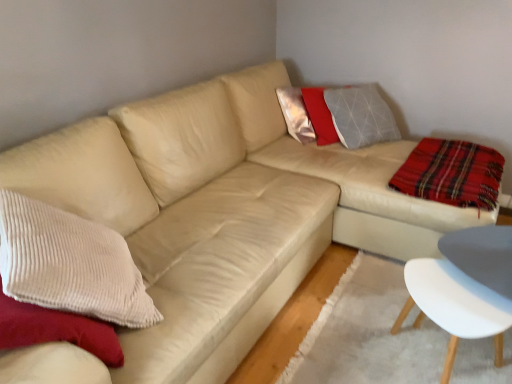
I want to click on free region on the left part of white plastic chair at lower right, so click(329, 330).